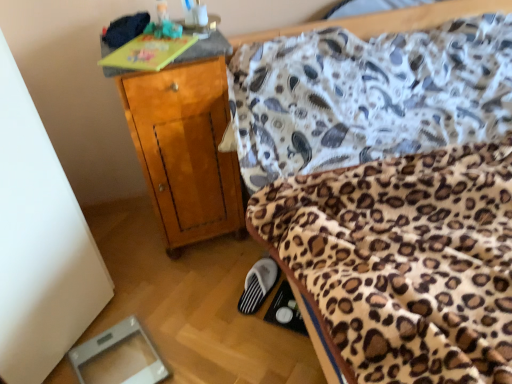
The height and width of the screenshot is (384, 512). I want to click on wooden nightstand at upper left, so click(x=185, y=143).

What is the approximate width of wooden nightstand at upper left?

The width of wooden nightstand at upper left is 19.58 inches.

What is the approximate height of wooden nightstand at upper left?

34.70 inches.

Describe the element at coordinates (185, 143) in the screenshot. I see `wooden nightstand at upper left` at that location.

The image size is (512, 384). What do you see at coordinates (258, 285) in the screenshot?
I see `black suede slipper at lower center` at bounding box center [258, 285].

This screenshot has height=384, width=512. I want to click on black suede slipper at lower center, so click(258, 285).

This screenshot has width=512, height=384. I want to click on wooden nightstand at upper left, so click(x=185, y=143).

Based on their positions, is wooden nightstand at upper left located to the left or right of black suede slipper at lower center?

wooden nightstand at upper left is to the left of black suede slipper at lower center.

Consider the image. Which is in front, wooden nightstand at upper left or black suede slipper at lower center?

Positioned in front is wooden nightstand at upper left.

Which point is more distant from viewer, (x=238, y=236) or (x=269, y=268)?

Positioned behind is point (x=238, y=236).

From the image's perspective, is wooden nightstand at upper left located beneath black suede slipper at lower center?

Incorrect, from the image's perspective, wooden nightstand at upper left is higher than black suede slipper at lower center.

From a real-world perspective, which object rests below the other?

black suede slipper at lower center, from a real-world perspective.

Which of these two, wooden nightstand at upper left or black suede slipper at lower center, is thinner?

Thinner between the two is black suede slipper at lower center.

Considering the sizes of objects wooden nightstand at upper left and black suede slipper at lower center in the image provided, who is shorter, wooden nightstand at upper left or black suede slipper at lower center?

black suede slipper at lower center.

Which of these two, wooden nightstand at upper left or black suede slipper at lower center, is bigger?

With larger size is wooden nightstand at upper left.

Is wooden nightstand at upper left not within black suede slipper at lower center?

Yes, wooden nightstand at upper left is not within black suede slipper at lower center.

Is wooden nightstand at upper left not near black suede slipper at lower center?

No, wooden nightstand at upper left is not far from black suede slipper at lower center.

Could you tell me if wooden nightstand at upper left is turned towards black suede slipper at lower center?

Yes.

Can you tell me how much wooden nightstand at upper left and black suede slipper at lower center differ in facing direction?

wooden nightstand at upper left and black suede slipper at lower center are facing 138 degrees away from each other.

Image resolution: width=512 pixels, height=384 pixels. In order to click on footwear below the wooden nightstand at upper left (from a real-world perspective) in this screenshot , I will do `click(258, 285)`.

From the picture: In the image, is black suede slipper at lower center on the left side or the right side of wooden nightstand at upper left?

Clearly, black suede slipper at lower center is on the right of wooden nightstand at upper left in the image.

Considering the relative positions of black suede slipper at lower center and wooden nightstand at upper left in the image provided, is black suede slipper at lower center behind wooden nightstand at upper left?

Yes, it is behind wooden nightstand at upper left.

Does point (266, 295) come closer to viewer compared to point (239, 237)?

Yes, it is.

From the image's perspective, would you say black suede slipper at lower center is shown under wooden nightstand at upper left?

Correct, black suede slipper at lower center appears lower than wooden nightstand at upper left in the image.

From a real-world perspective, who is located lower, black suede slipper at lower center or wooden nightstand at upper left?

black suede slipper at lower center, from a real-world perspective.

Is black suede slipper at lower center wider or thinner than wooden nightstand at upper left?

In the image, black suede slipper at lower center appears to be more narrow than wooden nightstand at upper left.

Considering the sizes of black suede slipper at lower center and wooden nightstand at upper left in the image, is black suede slipper at lower center taller or shorter than wooden nightstand at upper left?

In the image, black suede slipper at lower center appears to be shorter than wooden nightstand at upper left.

Is black suede slipper at lower center bigger or smaller than wooden nightstand at upper left?

black suede slipper at lower center is smaller than wooden nightstand at upper left.

Does black suede slipper at lower center contain wooden nightstand at upper left?

No, wooden nightstand at upper left is located outside of black suede slipper at lower center.

Is black suede slipper at lower center placed right next to wooden nightstand at upper left?

black suede slipper at lower center is not next to wooden nightstand at upper left, and they're not touching.

Could you tell me if black suede slipper at lower center is facing wooden nightstand at upper left?

No, black suede slipper at lower center does not turn towards wooden nightstand at upper left.

You are a GUI agent. You are given a task and a screenshot of the screen. Output one action in this format:
    pyautogui.click(x=<x>, y=<y>)
    Task: Click on the footwear that appears below the wooden nightstand at upper left (from a real-world perspective)
    This screenshot has width=512, height=384.
    Given the screenshot: What is the action you would take?
    pyautogui.click(x=258, y=285)

You are a GUI agent. You are given a task and a screenshot of the screen. Output one action in this format:
    pyautogui.click(x=<x>, y=<y>)
    Task: Click on the nightstand above the black suede slipper at lower center (from the image's perspective)
    
    Given the screenshot: What is the action you would take?
    pyautogui.click(x=185, y=143)

At what (x,y) coordinates should I click in order to perform the action: click on nightstand in front of the black suede slipper at lower center. Please return your answer as a coordinate pair (x, y). This screenshot has width=512, height=384. Looking at the image, I should click on (185, 143).